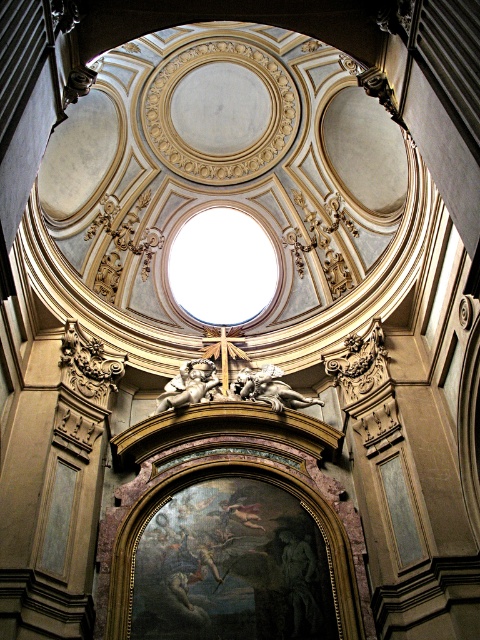
Question: Which object appears closest to the camera in this image?

Choices:
 (A) golden metallic cherub at center
 (B) sculpted gold cherub at center

Answer: (B)

Question: Which of the following is the farthest from the observer?

Choices:
 (A) golden metallic cherub at center
 (B) sculpted gold cherub at center

Answer: (A)

Question: Does sculpted gold cherub at center appear over golden metallic cherub at center?

Choices:
 (A) yes
 (B) no

Answer: (B)

Question: Can you confirm if sculpted gold cherub at center is positioned to the right of golden metallic cherub at center?

Choices:
 (A) yes
 (B) no

Answer: (A)

Question: Which of the following is the closest to the observer?

Choices:
 (A) (211, 372)
 (B) (244, 385)

Answer: (B)

Question: Does sculpted gold cherub at center come in front of golden metallic cherub at center?

Choices:
 (A) no
 (B) yes

Answer: (B)